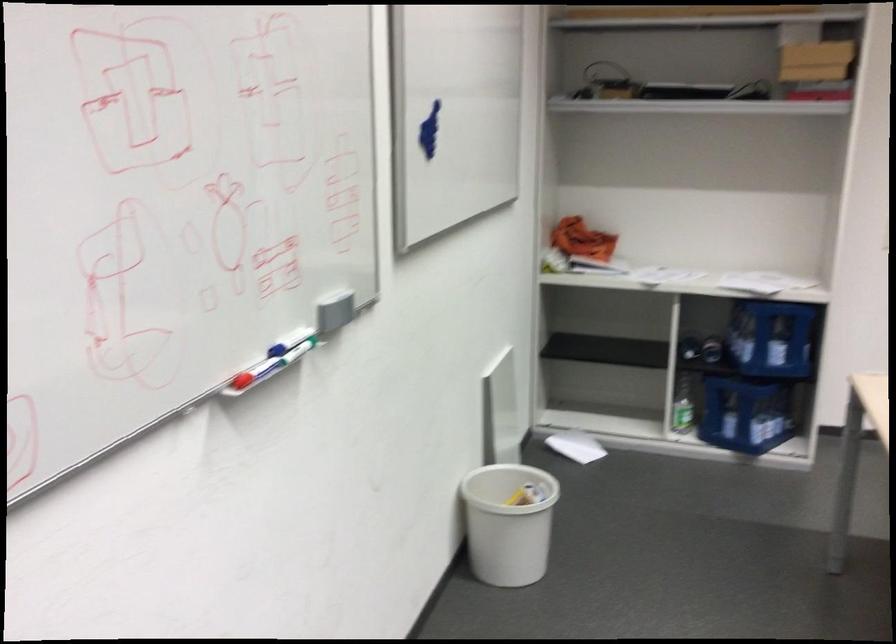
Locate an element on the screen. blue whiteboard marker is located at coordinates 291,337.